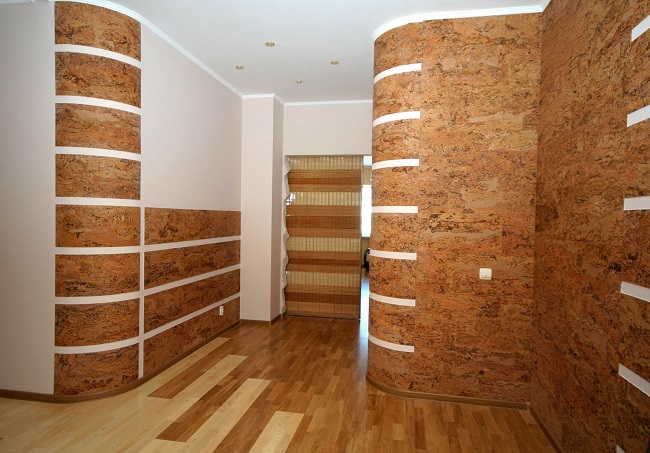
Locate an element on the screen. This screenshot has width=650, height=453. pillar is located at coordinates (255, 163).